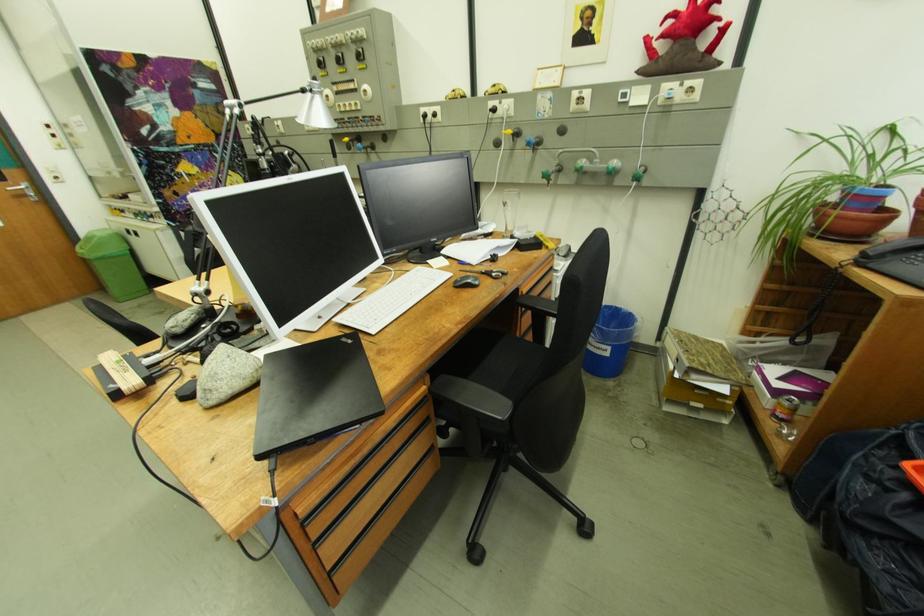
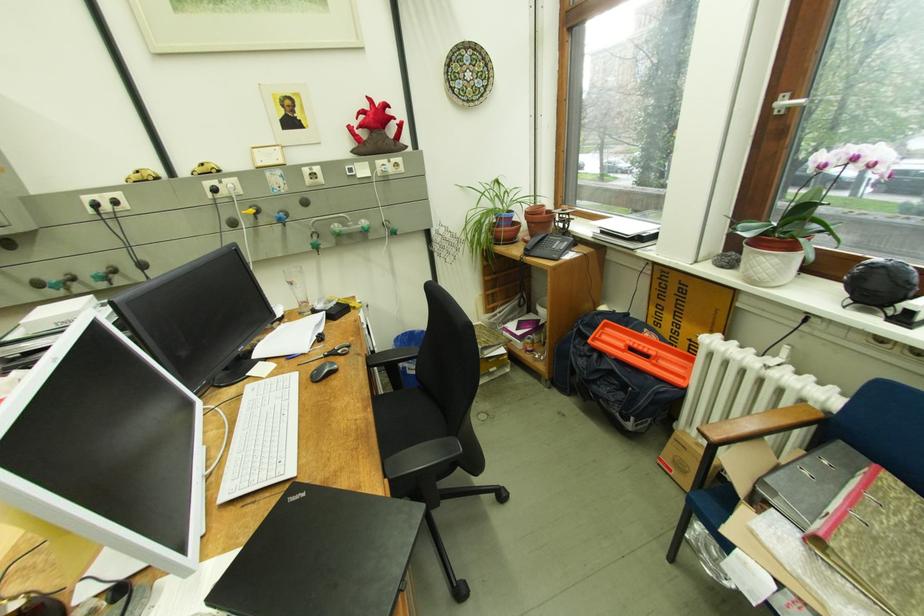
The point at (360, 342) is marked in the first image. Where is the corresponding point in the second image?

(312, 496)